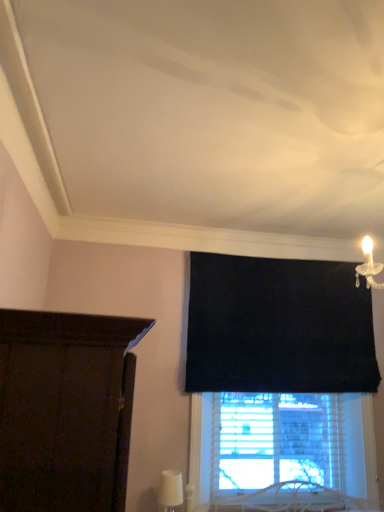
Identify the location of white glossy table lamp at lower center. (170, 490).

Describe the element at coordinates (170, 490) in the screenshot. The image size is (384, 512). I see `white glossy table lamp at lower center` at that location.

Measure the distance between point (173, 475) and camera.

The depth of point (173, 475) is 2.57 meters.

Locate an element on the screen. white glossy table lamp at lower center is located at coordinates pos(170,490).